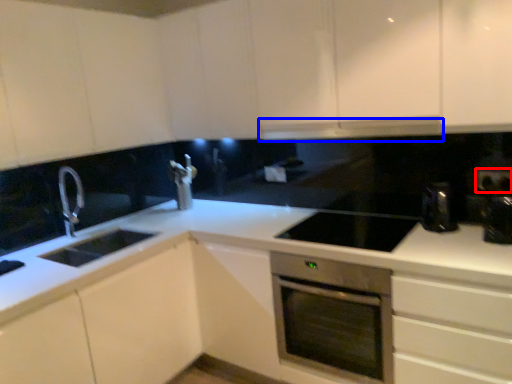
Question: Among these objects, which one is farthest to the camera, electric outlet (highlighted by a red box) or exhaust hood (highlighted by a blue box)?

Choices:
 (A) electric outlet
 (B) exhaust hood

Answer: (A)